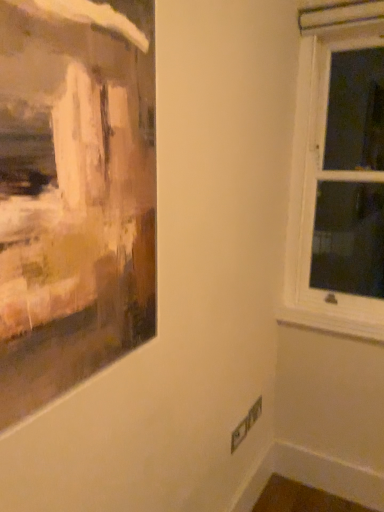
Question: Is white painted wood at lower right inside or outside of white wooden window at right?

Choices:
 (A) inside
 (B) outside

Answer: (B)

Question: Looking at the image, does white painted wood at lower right seem bigger or smaller compared to white wooden window at right?

Choices:
 (A) big
 (B) small

Answer: (B)

Question: Is point (329, 324) positioned closer to the camera than point (314, 18)?

Choices:
 (A) farther
 (B) closer

Answer: (A)

Question: From a real-world perspective, is white wooden window at right physically located above or below white painted wood at lower right?

Choices:
 (A) above
 (B) below

Answer: (A)

Question: From the image's perspective, is white wooden window at right above or below white painted wood at lower right?

Choices:
 (A) below
 (B) above

Answer: (B)

Question: In terms of width, does white wooden window at right look wider or thinner when compared to white painted wood at lower right?

Choices:
 (A) wide
 (B) thin

Answer: (A)

Question: In the image, is white wooden window at right positioned in front of or behind white painted wood at lower right?

Choices:
 (A) front
 (B) behind

Answer: (A)